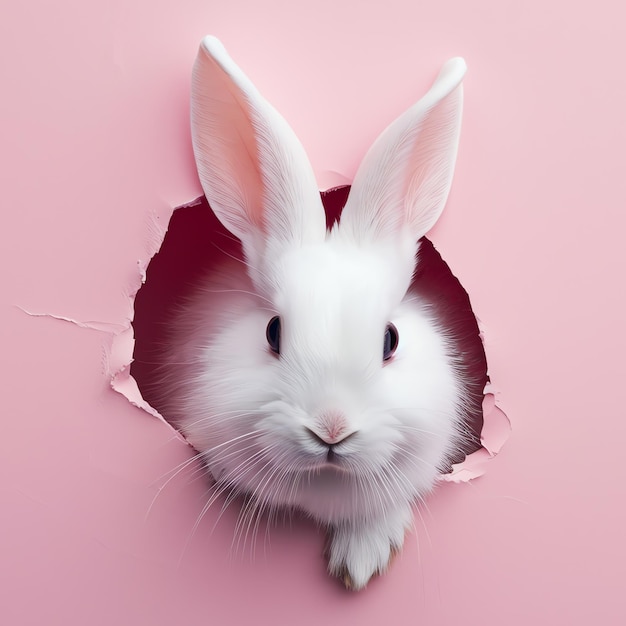
The width and height of the screenshot is (626, 626). What are the coordinates of `box` in the screenshot? It's located at (573, 367).